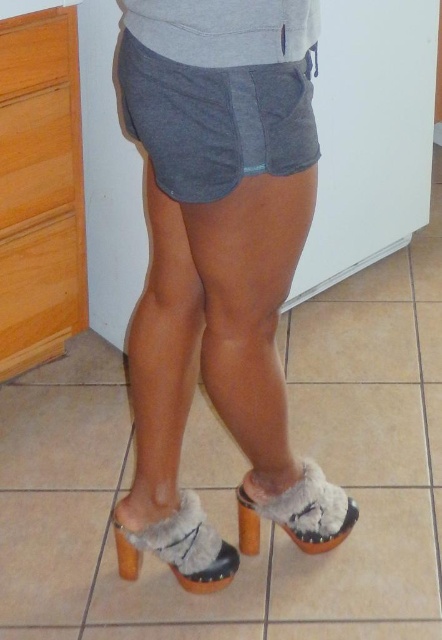
You are a fashion designer analyzing the footwear in the image. You need to determine which part of the shoes takes up more space visually. Which object is larger in size between the furry suede clogs at lower center and the fuzzy fabric heel at lower center?

The furry suede clogs at lower center is larger in size than the fuzzy fabric heel at lower center, so the furry suede clogs at lower center takes up more visual space.

Consider the image. You are a fashion designer trying to create a new shoe design that combines both the furry suede clogs at lower center and the fuzzy fabric heel at lower center. How far apart should you place these two elements in your design?

The furry suede clogs at lower center and fuzzy fabric heel at lower center are 19.18 inches apart in the image, so you should place them 19.18 inches apart in your design.